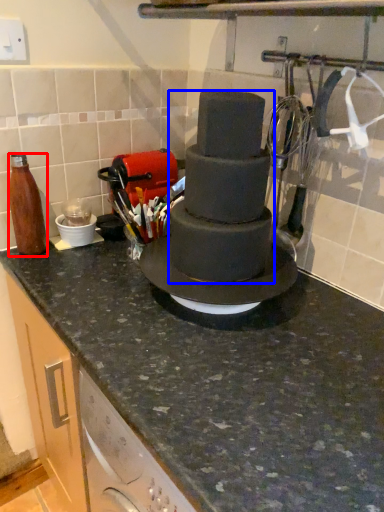
Question: Which point is further to the camera, bottle (highlighted by a red box) or chocolate cake (highlighted by a blue box)?

Choices:
 (A) bottle
 (B) chocolate cake

Answer: (A)